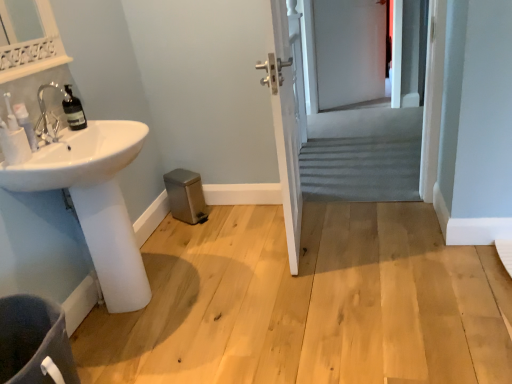
Measure the distance between matte white soap dispenser at left and camera.

matte white soap dispenser at left is 1.53 meters away from camera.

Image resolution: width=512 pixels, height=384 pixels. Find the location of `matte white soap dispenser at left`. matte white soap dispenser at left is located at coordinates (26, 124).

What is the approximate width of gray fabric screen door at center, acting as the second screen door starting from the back?

It is 17.95 centimeters.

Identify the location of white matte screen door at upper center, the second screen door from the front. (350, 51).

Measure the distance between point (x=114, y=168) and camera.

A: A distance of 5.22 feet exists between point (x=114, y=168) and camera.

Image resolution: width=512 pixels, height=384 pixels. I want to click on white glossy sink at lower left, so click(x=94, y=200).

At what (x,y) coordinates should I click in order to perform the action: click on white wooden door at center. Please return your answer as a coordinate pair (x, y). The height and width of the screenshot is (384, 512). Looking at the image, I should click on (285, 127).

Consider the image. Which is correct: white wooden door at center is inside translucent glass bottle at left, or outside of it?

white wooden door at center exists outside the volume of translucent glass bottle at left.

Does point (283, 56) come farther from viewer compared to point (77, 122)?

No.

Considering the relative sizes of white wooden door at center and translucent glass bottle at left in the image provided, is white wooden door at center wider than translucent glass bottle at left?

Indeed, white wooden door at center has a greater width compared to translucent glass bottle at left.

Would you consider translucent glass bottle at left to be distant from white glossy sink at lower left?

No, there isn't a large distance between translucent glass bottle at left and white glossy sink at lower left.

From the image's perspective, is translucent glass bottle at left located beneath white glossy sink at lower left?

A: Actually, translucent glass bottle at left appears above white glossy sink at lower left in the image.

From a real-world perspective, is translucent glass bottle at left over white glossy sink at lower left?

Indeed, from a real-world perspective, translucent glass bottle at left stands above white glossy sink at lower left.

Is translucent glass bottle at left oriented away from white glossy sink at lower left?

That's not correct — translucent glass bottle at left is not looking away from white glossy sink at lower left.

Is gray fabric screen door at center, the first screen door when ordered from front to back, next to dark gray fabric toilet bowl at lower left?

No, gray fabric screen door at center, the first screen door when ordered from front to back, is not in contact with dark gray fabric toilet bowl at lower left.

Between gray fabric screen door at center, the first screen door when ordered from front to back, and dark gray fabric toilet bowl at lower left, which one appears on the right side from the viewer's perspective?

From the viewer's perspective, gray fabric screen door at center, the first screen door when ordered from front to back, appears more on the right side.

Which object is thinner, gray fabric screen door at center, which is the second screen door from top to bottom, or dark gray fabric toilet bowl at lower left?

gray fabric screen door at center, which is the second screen door from top to bottom.

Could you measure the distance between gray fabric screen door at center, which is the first screen door from bottom to top, and dark gray fabric toilet bowl at lower left?

gray fabric screen door at center, which is the first screen door from bottom to top, and dark gray fabric toilet bowl at lower left are 3.00 meters apart.

From a real-world perspective, is white glossy sink at lower left physically located above or below white matte screen door at upper center, the second screen door from the front?

white glossy sink at lower left is situated lower than white matte screen door at upper center, the second screen door from the front, in the real world.

Can you confirm if white glossy sink at lower left is wider than white matte screen door at upper center, which ranks as the first screen door in back-to-front order?

Indeed, white glossy sink at lower left has a greater width compared to white matte screen door at upper center, which ranks as the first screen door in back-to-front order.

Is white glossy sink at lower left outside of white matte screen door at upper center, the second screen door when ordered from bottom to top?

Yes, white glossy sink at lower left is outside of white matte screen door at upper center, the second screen door when ordered from bottom to top.

How far apart are translucent glass bottle at left and gray fabric screen door at center, the first screen door when ordered from front to back?

translucent glass bottle at left and gray fabric screen door at center, the first screen door when ordered from front to back, are 2.55 meters apart from each other.

Would you say translucent glass bottle at left is to the left or to the right of gray fabric screen door at center, the first screen door when ordered from front to back, in the picture?

Clearly, translucent glass bottle at left is on the left of gray fabric screen door at center, the first screen door when ordered from front to back, in the image.

From a real-world perspective, is translucent glass bottle at left on top of gray fabric screen door at center, which is the first screen door from bottom to top?

Yes, from a real-world perspective, translucent glass bottle at left is above gray fabric screen door at center, which is the first screen door from bottom to top.

Would you say translucent glass bottle at left is inside or outside gray fabric screen door at center, which is the second screen door from top to bottom?

translucent glass bottle at left is outside gray fabric screen door at center, which is the second screen door from top to bottom.

Considering the relative sizes of dark gray fabric toilet bowl at lower left and white glossy sink at lower left in the image provided, is dark gray fabric toilet bowl at lower left smaller than white glossy sink at lower left?

Yes, dark gray fabric toilet bowl at lower left is smaller than white glossy sink at lower left.

Is white glossy sink at lower left at the back of dark gray fabric toilet bowl at lower left?

No, white glossy sink at lower left is not at the back of dark gray fabric toilet bowl at lower left.

Which object is further away from the camera taking this photo, dark gray fabric toilet bowl at lower left or white glossy sink at lower left?

Positioned behind is white glossy sink at lower left.

How far apart are dark gray fabric toilet bowl at lower left and white matte screen door at upper center, the second screen door when ordered from bottom to top?

dark gray fabric toilet bowl at lower left is 3.82 meters away from white matte screen door at upper center, the second screen door when ordered from bottom to top.

The height and width of the screenshot is (384, 512). I want to click on toilet bowl directly beneath the white matte screen door at upper center, arranged as the first screen door when viewed from the top (from a real-world perspective), so click(34, 342).

Is dark gray fabric toilet bowl at lower left oriented away from white matte screen door at upper center, arranged as the first screen door when viewed from the top?

dark gray fabric toilet bowl at lower left is not turned away from white matte screen door at upper center, arranged as the first screen door when viewed from the top.

Find the location of `bottle behind the white wooden door at center`. bottle behind the white wooden door at center is located at coordinates (73, 110).

The image size is (512, 384). Identify the location of bottle on the left of white glossy sink at lower left. (73, 110).

Looking at the image, which one is located closer to translucent glass bottle at left, dark gray fabric toilet bowl at lower left or white glossy sink at lower left?

Among the two, white glossy sink at lower left is located nearer to translucent glass bottle at left.

In the scene shown: Looking at the image, which one is located further to matte white soap dispenser at left, white wooden door at center or dark gray fabric toilet bowl at lower left?

white wooden door at center.

Considering their positions, is gray fabric screen door at center, which is the first screen door from bottom to top, positioned further to white glossy sink at lower left than matte white soap dispenser at left?

gray fabric screen door at center, which is the first screen door from bottom to top.

Considering their positions, is dark gray fabric toilet bowl at lower left positioned further to white wooden door at center than white matte screen door at upper center, which ranks as the first screen door in back-to-front order?

white matte screen door at upper center, which ranks as the first screen door in back-to-front order, is further to white wooden door at center.

From the image, which object appears to be farther from dark gray fabric toilet bowl at lower left, white matte screen door at upper center, the second screen door when ordered from bottom to top, or translucent glass bottle at left?

Based on the image, white matte screen door at upper center, the second screen door when ordered from bottom to top, appears to be further to dark gray fabric toilet bowl at lower left.

Which object lies further to the anchor point white glossy sink at lower left, translucent glass bottle at left or matte white soap dispenser at left?

matte white soap dispenser at left is further to white glossy sink at lower left.

When comparing their distances from white glossy sink at lower left, does translucent glass bottle at left or white matte screen door at upper center, arranged as the first screen door when viewed from the top, seem closer?

translucent glass bottle at left is closer to white glossy sink at lower left.

Estimate the real-world distances between objects in this image. Which object is closer to dark gray fabric toilet bowl at lower left, matte white soap dispenser at left or gray fabric screen door at center, acting as the second screen door starting from the back?

Among the two, matte white soap dispenser at left is located nearer to dark gray fabric toilet bowl at lower left.

This screenshot has width=512, height=384. I want to click on toilet bowl between matte white soap dispenser at left and white wooden door at center in the horizontal direction, so click(34, 342).

Locate an element on the screen. The width and height of the screenshot is (512, 384). screen door between white wooden door at center and white matte screen door at upper center, which ranks as the first screen door in back-to-front order, from front to back is located at coordinates (355, 111).

Locate an element on the screen. This screenshot has height=384, width=512. bottle between matte white soap dispenser at left and white matte screen door at upper center, which ranks as the first screen door in back-to-front order, from front to back is located at coordinates (73, 110).

Find the location of a particular element. door between white glossy sink at lower left and gray fabric screen door at center, which is the first screen door from bottom to top, from left to right is located at coordinates (285, 127).